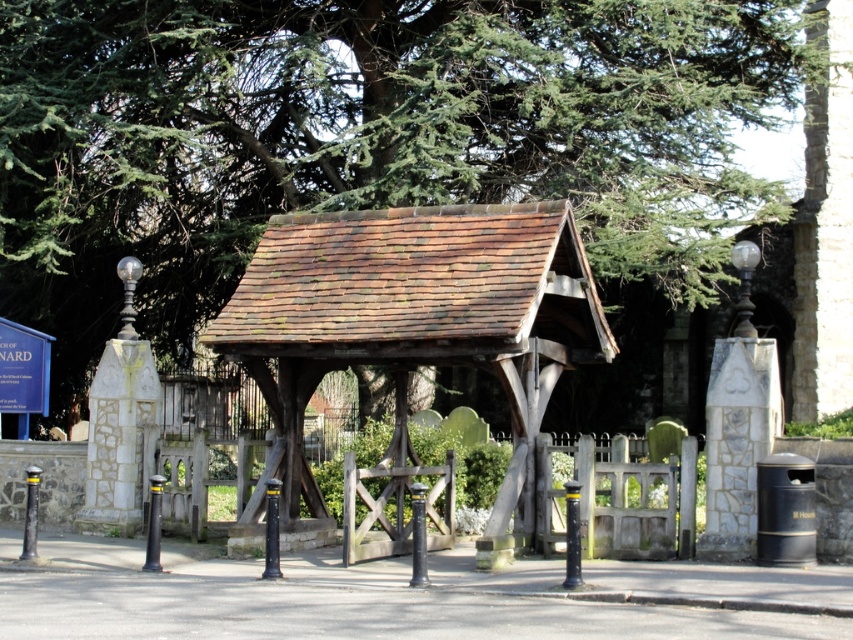
Question: Considering the relative positions of green leafy tree at upper center and rusty wood lychgate at center in the image provided, where is green leafy tree at upper center located with respect to rusty wood lychgate at center?

Choices:
 (A) above
 (B) below

Answer: (A)

Question: Can you confirm if green leafy tree at upper center is wider than rusty wood lychgate at center?

Choices:
 (A) no
 (B) yes

Answer: (B)

Question: Which point appears farthest from the camera in this image?

Choices:
 (A) (509, 314)
 (B) (606, 253)

Answer: (B)

Question: Which of the following is the farthest from the observer?

Choices:
 (A) rusty wood lychgate at center
 (B) green leafy tree at upper center

Answer: (B)

Question: Does green leafy tree at upper center appear on the left side of rusty wood lychgate at center?

Choices:
 (A) no
 (B) yes

Answer: (A)